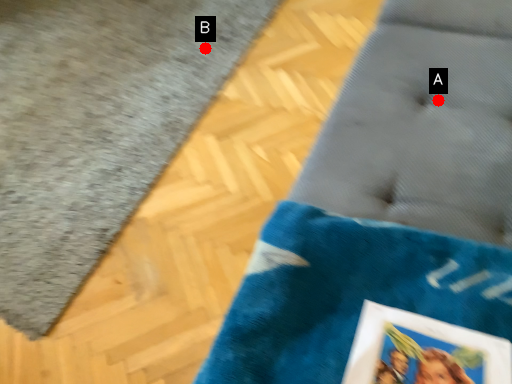
Question: Two points are circled on the image, labeled by A and B beside each circle. Which point is farther from the camera taking this photo?

Choices:
 (A) A is further
 (B) B is further

Answer: (B)